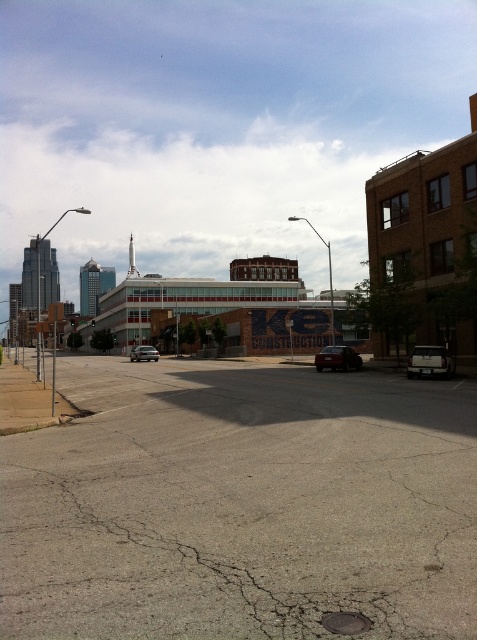
Is the position of asphalt road at center less distant than that of satin silver sedan at center?

Yes, asphalt road at center is in front of satin silver sedan at center.

Which of these two, asphalt road at center or satin silver sedan at center, stands shorter?

asphalt road at center is shorter.

Which is behind, point (389, 516) or point (143, 355)?

Positioned behind is point (143, 355).

Find the location of a particular element. asphalt road at center is located at coordinates (240, 506).

Is point (389, 628) closer to camera compared to point (319, 365)?

Yes, it is in front of point (319, 365).

The image size is (477, 640). I want to click on asphalt road at center, so click(240, 506).

This screenshot has width=477, height=640. Describe the element at coordinates (338, 358) in the screenshot. I see `shiny red sedan at center` at that location.

Can you confirm if shiny red sedan at center is shorter than satin silver sedan at center?

Yes.

Is point (321, 365) positioned in front of point (155, 355)?

Yes, point (321, 365) is in front of point (155, 355).

At what (x,y) coordinates should I click in order to perform the action: click on shiny red sedan at center. Please return your answer as a coordinate pair (x, y). The height and width of the screenshot is (640, 477). Looking at the image, I should click on (338, 358).